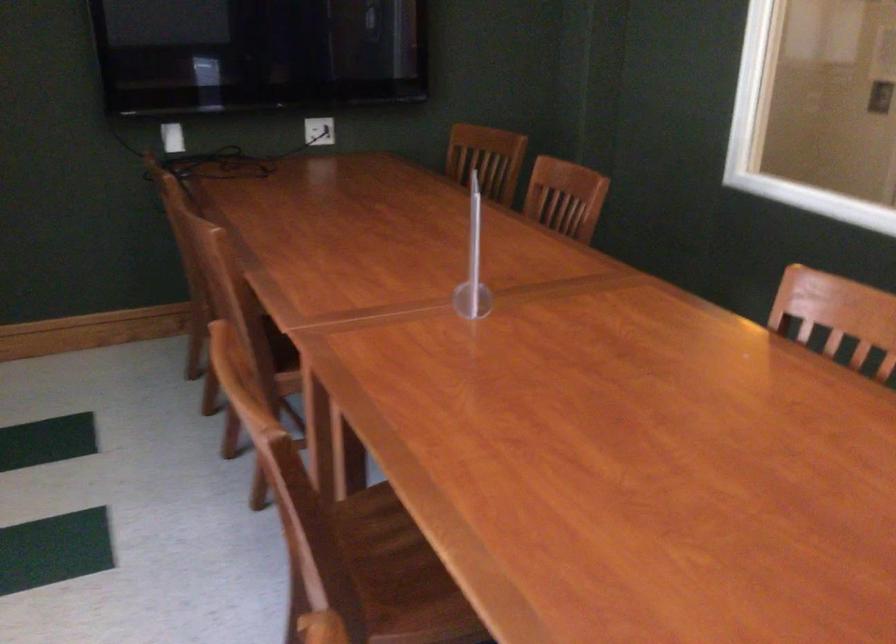
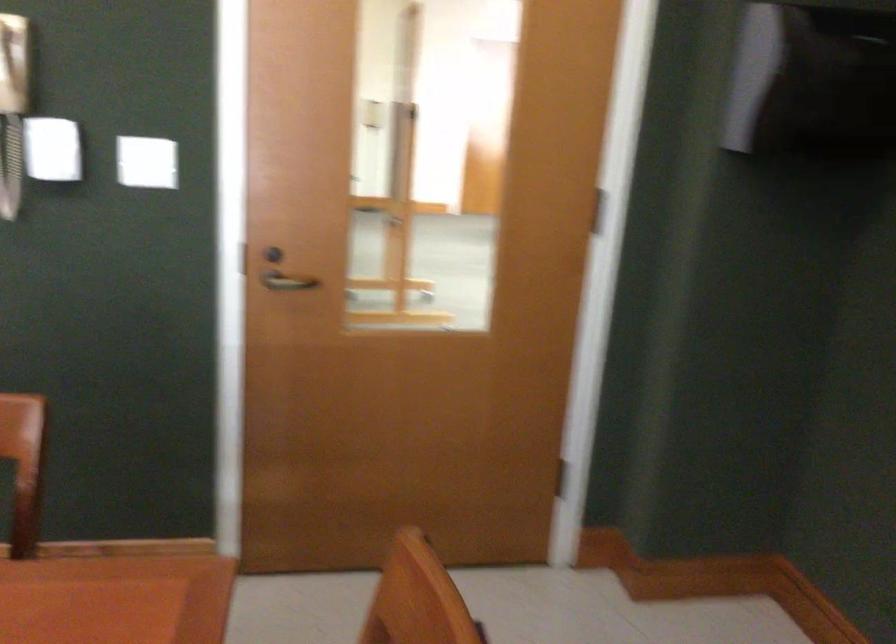
Question: Based on the continuous images, in which direction is the camera rotating? Reply with the corresponding letter.

Choices:
 (A) Left
 (B) Right
 (C) Up
 (D) Down

Answer: (B)